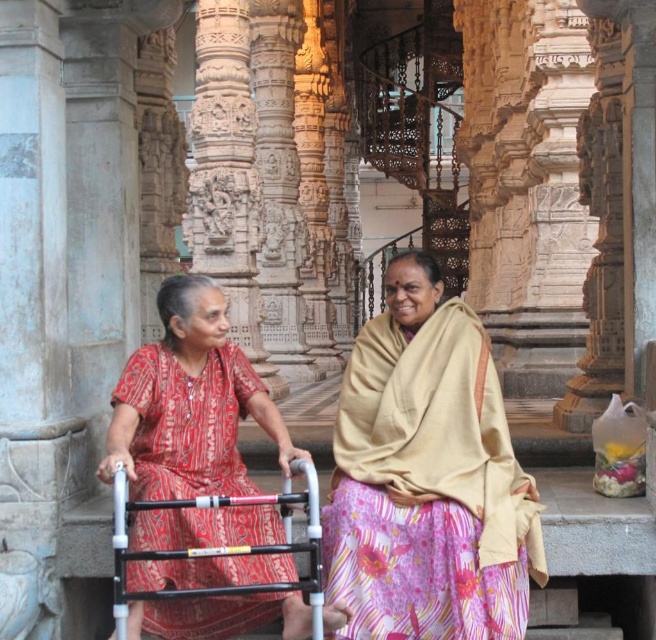
Question: Is beige fabric shawl at center smaller than red printed dress at center?

Choices:
 (A) no
 (B) yes

Answer: (B)

Question: Among these objects, which one is nearest to the camera?

Choices:
 (A) red printed dress at center
 (B) beige fabric shawl at center

Answer: (A)

Question: Which object is closer to the camera taking this photo?

Choices:
 (A) beige fabric shawl at center
 (B) red printed dress at center

Answer: (B)

Question: Can you confirm if beige fabric shawl at center is positioned above red printed dress at center?

Choices:
 (A) yes
 (B) no

Answer: (B)

Question: Which of the following is the farthest from the observer?

Choices:
 (A) red printed dress at center
 (B) beige fabric shawl at center

Answer: (B)

Question: Is the position of beige fabric shawl at center more distant than that of red printed dress at center?

Choices:
 (A) no
 (B) yes

Answer: (B)